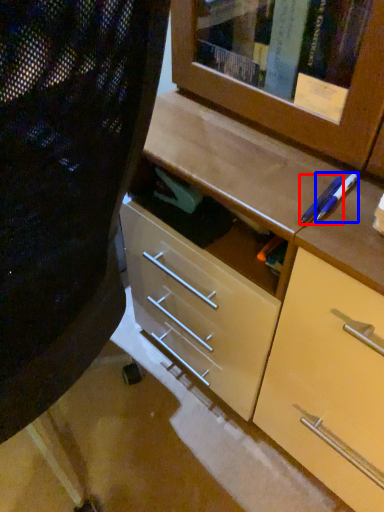
Question: Which point is further to the camera, pencil (highlighted by a red box) or pencil (highlighted by a blue box)?

Choices:
 (A) pencil
 (B) pencil

Answer: (B)